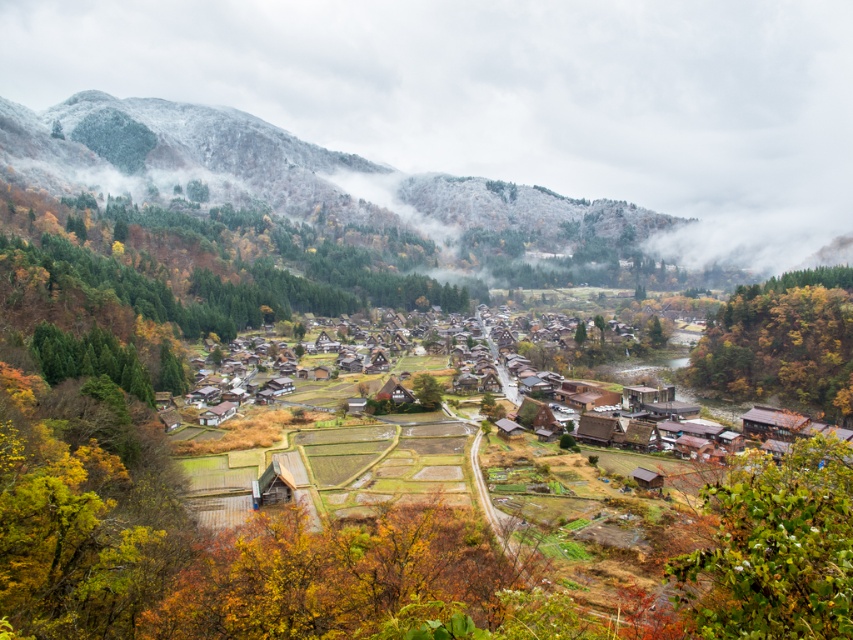
Question: Is snow-covered forest at upper left above green leafy tree at lower right?

Choices:
 (A) no
 (B) yes

Answer: (B)

Question: From the image, what is the correct spatial relationship of green leafy tree at lower right in relation to autumn leaves at right?

Choices:
 (A) below
 (B) above

Answer: (A)

Question: Among these objects, which one is nearest to the camera?

Choices:
 (A) green leafy tree at lower right
 (B) autumn leaves at right
 (C) snow-covered forest at upper left

Answer: (A)

Question: Which of the following is the farthest from the observer?

Choices:
 (A) autumn leaves at right
 (B) green leafy tree at lower right

Answer: (A)

Question: Does green leafy tree at lower right appear under autumn leaves at right?

Choices:
 (A) yes
 (B) no

Answer: (A)

Question: Which is farther from the green leafy tree at lower right?

Choices:
 (A) autumn leaves at right
 (B) snow-covered forest at upper left

Answer: (B)